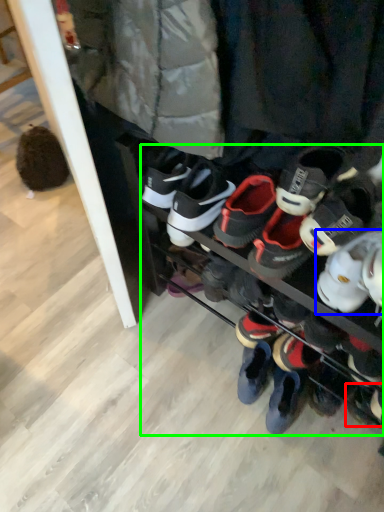
Question: Which object is positioned farthest from footwear (highlighted by a red box)? Select from footwear (highlighted by a blue box) and footwear (highlighted by a green box).

Choices:
 (A) footwear
 (B) footwear

Answer: (A)